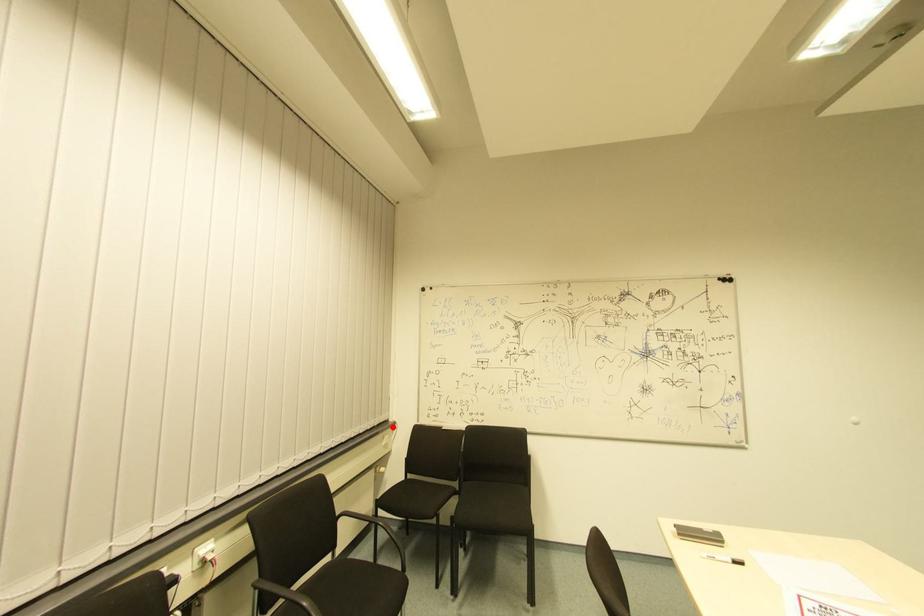
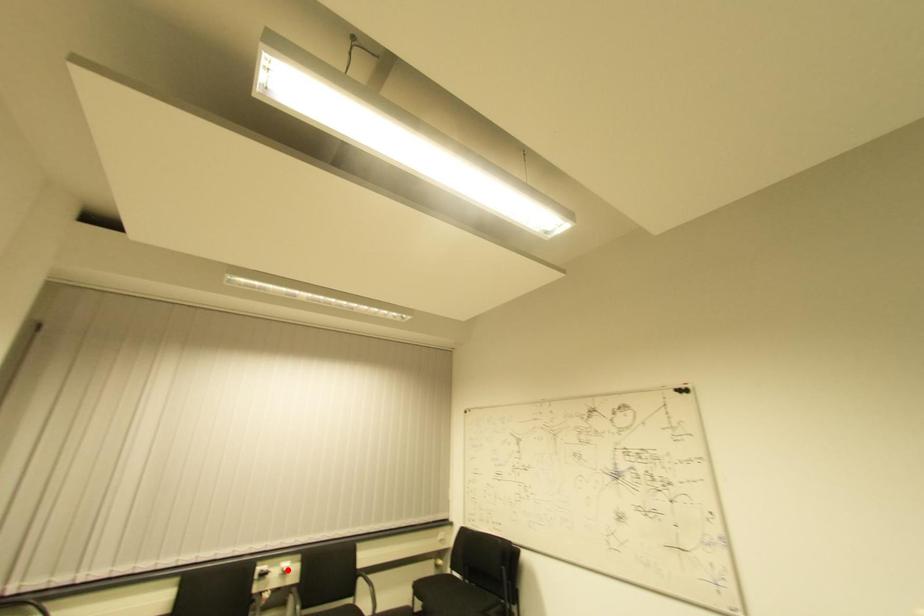
I am providing you with two images of the same scene from different viewpoints. A red point is marked on the first image and another point is marked on the second image. Do the highlighted points in image1 and image2 indicate the same real-world spot?

No